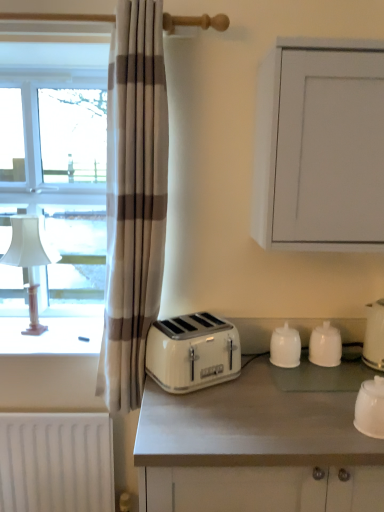
This screenshot has height=512, width=384. What are the coordinates of `vacant space situated above white matte countertop at center (from a real-world perspective)` in the screenshot? It's located at (272, 394).